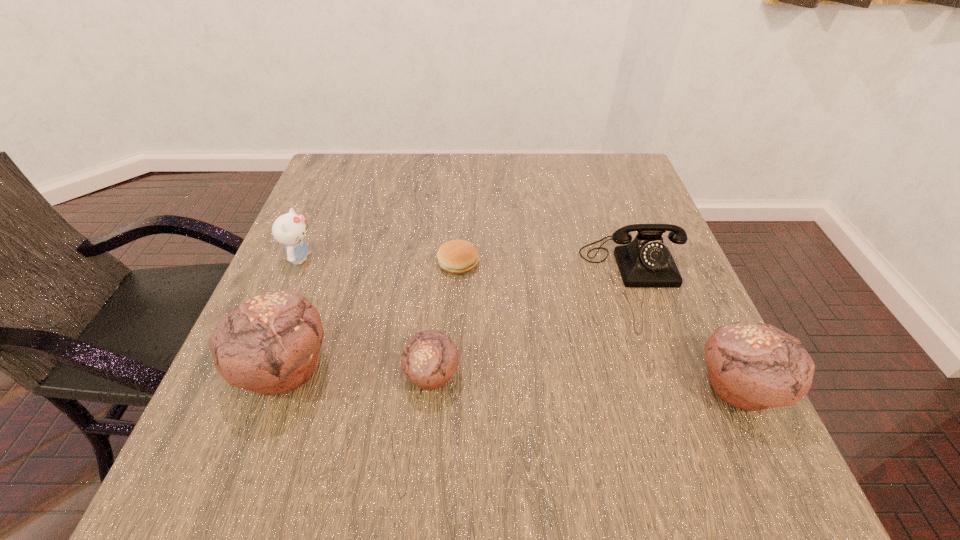
I want to click on free space that satisfies the following two spatial constraints: 1. on the front-facing side of the kitten; 2. on the right side of the leftmost muffin, so click(253, 368).

This screenshot has height=540, width=960. What are the coordinates of `vacant area that satisfies the following two spatial constraints: 1. on the front-facing side of the kitten; 2. on the back side of the patty` in the screenshot? It's located at (x=299, y=263).

Where is `free location that satisfies the following two spatial constraints: 1. on the front-facing side of the patty; 2. on the right side of the kitten`? free location that satisfies the following two spatial constraints: 1. on the front-facing side of the patty; 2. on the right side of the kitten is located at coordinates (299, 263).

This screenshot has height=540, width=960. Find the location of `vacant point that satisfies the following two spatial constraints: 1. on the front side of the rightmost muffin; 2. on the right side of the leftmost muffin`. vacant point that satisfies the following two spatial constraints: 1. on the front side of the rightmost muffin; 2. on the right side of the leftmost muffin is located at coordinates (277, 388).